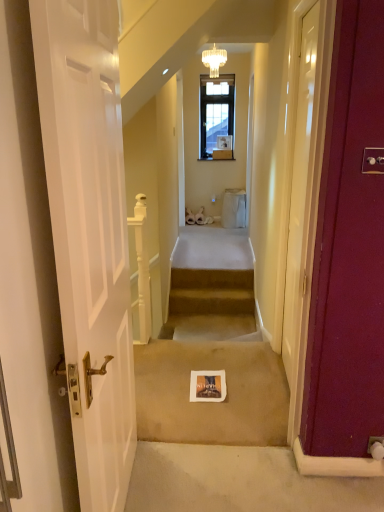
Question: Is beige carpet at center positioned before white wooden door at left, which appears as the 2th door when viewed from the right?

Choices:
 (A) no
 (B) yes

Answer: (A)

Question: Is white wooden door at left, which is the first door from left to right, inside beige carpet at center?

Choices:
 (A) no
 (B) yes

Answer: (A)

Question: From the image's perspective, is beige carpet at center beneath white wooden door at left, which ranks as the first door in front-to-back order?

Choices:
 (A) no
 (B) yes

Answer: (B)

Question: Is beige carpet at center not near white wooden door at left, which ranks as the first door in front-to-back order?

Choices:
 (A) yes
 (B) no

Answer: (A)

Question: From the image's perspective, is beige carpet at center on white wooden door at left, which is the first door from left to right?

Choices:
 (A) no
 (B) yes

Answer: (A)

Question: Considering the positions of beige carpeted stairs at center and white glossy door at right, the second door when ordered from left to right, in the image, is beige carpeted stairs at center wider or thinner than white glossy door at right, the second door when ordered from left to right,?

Choices:
 (A) thin
 (B) wide

Answer: (B)

Question: Visually, is beige carpeted stairs at center positioned to the left or to the right of white glossy door at right, which is counted as the 1th door, starting from the back?

Choices:
 (A) right
 (B) left

Answer: (B)

Question: Is beige carpeted stairs at center spatially inside white glossy door at right, which is counted as the 1th door, starting from the back, or outside of it?

Choices:
 (A) outside
 (B) inside

Answer: (A)

Question: From their relative heights in the image, would you say beige carpeted stairs at center is taller or shorter than white glossy door at right, the second door when ordered from left to right?

Choices:
 (A) tall
 (B) short

Answer: (B)

Question: Based on their sizes in the image, would you say white wooden door at left, which ranks as the first door in front-to-back order, is bigger or smaller than beige carpet at center?

Choices:
 (A) small
 (B) big

Answer: (B)

Question: Considering the positions of white wooden door at left, which is the first door from left to right, and beige carpet at center in the image, is white wooden door at left, which is the first door from left to right, wider or thinner than beige carpet at center?

Choices:
 (A) thin
 (B) wide

Answer: (A)

Question: Is white wooden door at left, which ranks as the first door in front-to-back order, inside or outside of beige carpet at center?

Choices:
 (A) inside
 (B) outside

Answer: (B)

Question: From a real-world perspective, is white wooden door at left, which appears as the 2th door when viewed from the right, physically located above or below beige carpet at center?

Choices:
 (A) below
 (B) above

Answer: (B)

Question: From a real-world perspective, relative to gold textured chandelier at upper center, is white wooden door at left, which ranks as the first door in front-to-back order, vertically above or below?

Choices:
 (A) above
 (B) below

Answer: (B)

Question: Is white wooden door at left, which appears as the 2th door when viewed from the right, in front of or behind gold textured chandelier at upper center in the image?

Choices:
 (A) front
 (B) behind

Answer: (A)